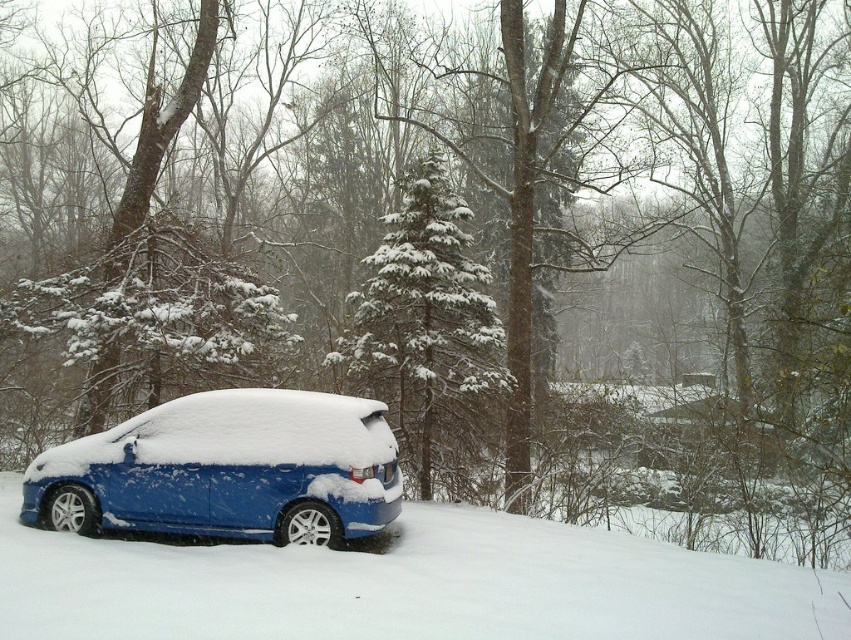
Question: Which point is closer to the camera?

Choices:
 (A) snow-covered evergreen tree at center
 (B) slick blue car at lower left

Answer: (B)

Question: Does blue metallic hatchback at lower left appear on the right side of snow-covered evergreen tree at center?

Choices:
 (A) no
 (B) yes

Answer: (A)

Question: Is blue metallic hatchback at lower left bigger than snow-covered evergreen tree at center?

Choices:
 (A) yes
 (B) no

Answer: (B)

Question: Where is slick blue car at lower left located in relation to blue metallic hatchback at lower left in the image?

Choices:
 (A) below
 (B) above

Answer: (A)

Question: Which is farther from the slick blue car at lower left?

Choices:
 (A) snow-covered evergreen tree at center
 (B) blue metallic hatchback at lower left

Answer: (A)

Question: Among these objects, which one is nearest to the camera?

Choices:
 (A) blue metallic hatchback at lower left
 (B) snow-covered evergreen tree at center

Answer: (A)